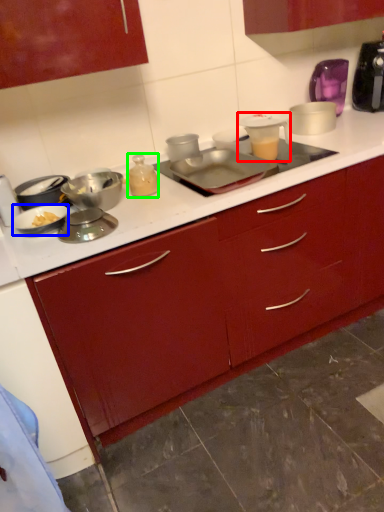
Question: Which object is positioned closest to appliance (highlighted by a red box)? Select from kitchen appliance (highlighted by a blue box) and bottle (highlighted by a green box).

Choices:
 (A) kitchen appliance
 (B) bottle

Answer: (B)